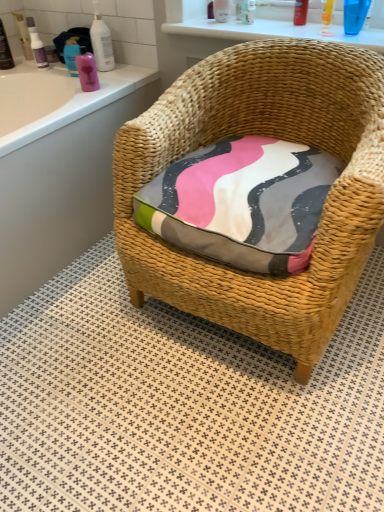
Question: From a real-world perspective, is matte black bottle at upper left, the 1th toiletry when ordered from left to right, on top of pink glossy bottle at upper left, which is counted as the 6th toiletry, starting from the right?

Choices:
 (A) no
 (B) yes

Answer: (B)

Question: From a real-world perspective, is matte black bottle at upper left, the 1th toiletry when ordered from left to right, below pink glossy bottle at upper left, which is counted as the 6th toiletry, starting from the right?

Choices:
 (A) yes
 (B) no

Answer: (B)

Question: Does matte black bottle at upper left, the 1th toiletry when ordered from left to right, have a greater height compared to pink glossy bottle at upper left, the fifth toiletry viewed from the left?

Choices:
 (A) yes
 (B) no

Answer: (A)

Question: Could you tell me if matte black bottle at upper left, which is the tenth toiletry from right to left, is facing pink glossy bottle at upper left, the fifth toiletry viewed from the left?

Choices:
 (A) no
 (B) yes

Answer: (B)

Question: Is matte black bottle at upper left, the 1th toiletry when ordered from left to right, closer to camera compared to pink glossy bottle at upper left, the fifth toiletry viewed from the left?

Choices:
 (A) yes
 (B) no

Answer: (B)

Question: Can pink glossy bottle at upper left, the fifth toiletry viewed from the left, be found inside matte black bottle at upper left, which is the tenth toiletry from right to left?

Choices:
 (A) yes
 (B) no

Answer: (B)

Question: Is transparent plastic cup at upper right, the 1th toiletry from the right, oriented away from white glossy bottle at upper left, the fifth toiletry in the right-to-left sequence?

Choices:
 (A) yes
 (B) no

Answer: (B)

Question: Does transparent plastic cup at upper right, placed as the tenth toiletry when sorted from left to right, have a larger size compared to white glossy bottle at upper left, the sixth toiletry viewed from the left?

Choices:
 (A) yes
 (B) no

Answer: (B)

Question: Does transparent plastic cup at upper right, placed as the tenth toiletry when sorted from left to right, have a greater height compared to white glossy bottle at upper left, the fifth toiletry in the right-to-left sequence?

Choices:
 (A) no
 (B) yes

Answer: (A)

Question: Considering the relative sizes of transparent plastic cup at upper right, placed as the tenth toiletry when sorted from left to right, and white glossy bottle at upper left, the fifth toiletry in the right-to-left sequence, in the image provided, is transparent plastic cup at upper right, placed as the tenth toiletry when sorted from left to right, smaller than white glossy bottle at upper left, the fifth toiletry in the right-to-left sequence,?

Choices:
 (A) no
 (B) yes

Answer: (B)

Question: Is transparent plastic cup at upper right, the 1th toiletry from the right, behind white glossy bottle at upper left, the sixth toiletry viewed from the left?

Choices:
 (A) no
 (B) yes

Answer: (A)

Question: From a real-world perspective, is transparent plastic cup at upper right, placed as the tenth toiletry when sorted from left to right, over white glossy bottle at upper left, the sixth toiletry viewed from the left?

Choices:
 (A) yes
 (B) no

Answer: (A)

Question: Is the position of white textured tile at center more distant than that of translucent plastic bottle at upper center, placed as the fourth toiletry when sorted from right to left?

Choices:
 (A) no
 (B) yes

Answer: (A)